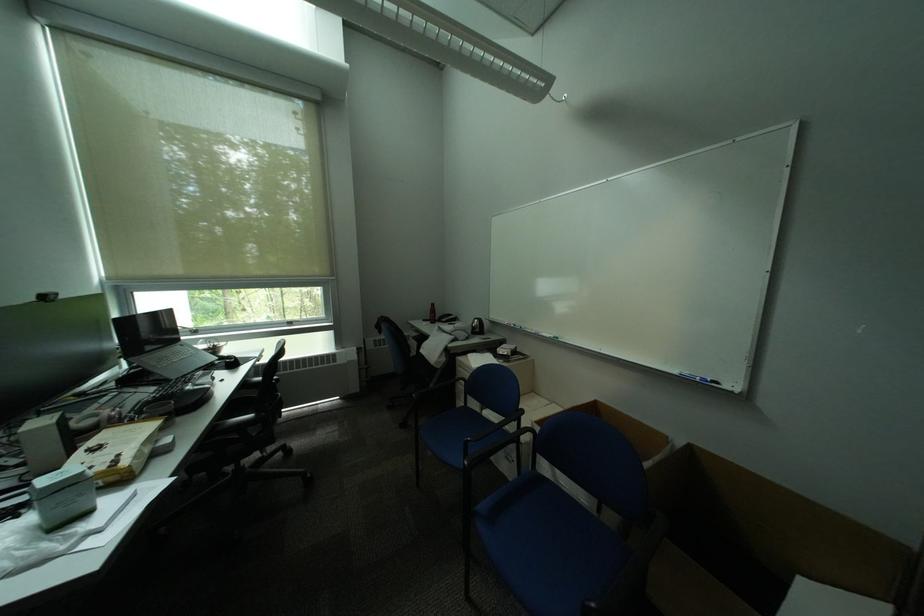
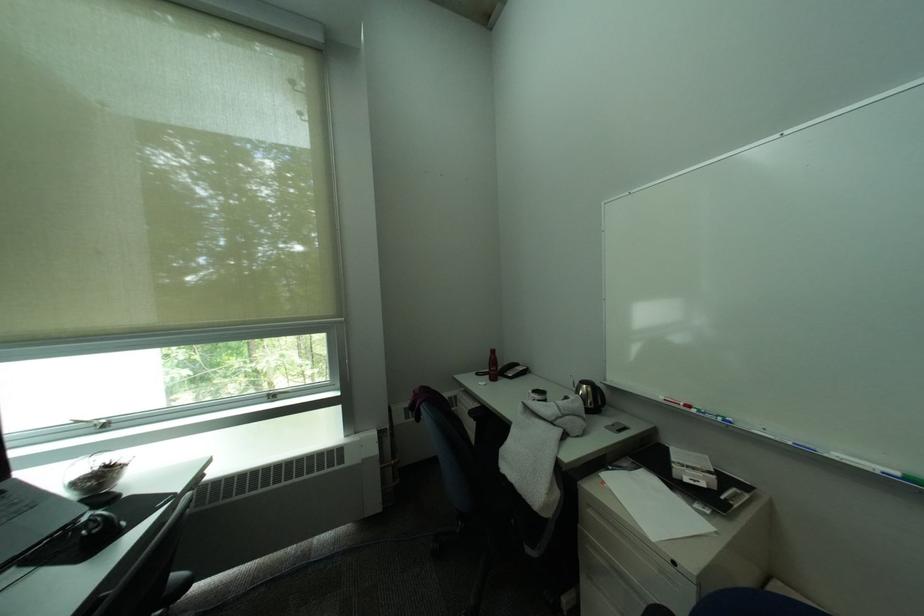
Find the pixel in the second image that matches pixel 202 331 in the first image.

(106, 427)